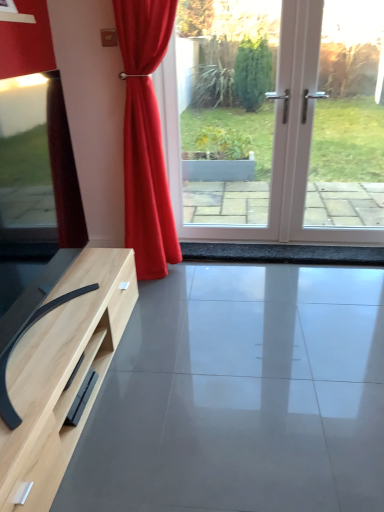
The width and height of the screenshot is (384, 512). In order to click on free location in front of satin red curtain at center in this screenshot , I will do `click(179, 297)`.